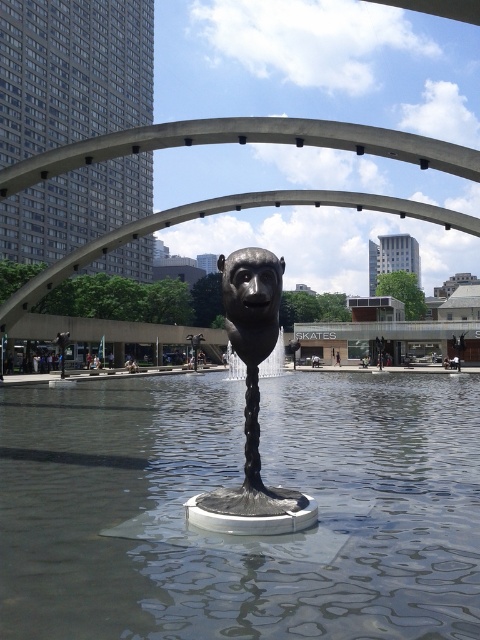
Question: Which object appears closest to the camera in this image?

Choices:
 (A) shiny bronze sculpture at center
 (B) shiny bronze face at center

Answer: (A)

Question: Which of the following is the closest to the observer?

Choices:
 (A) (256, 346)
 (B) (463, 544)

Answer: (B)

Question: Which point is closer to the camera taking this photo?

Choices:
 (A) (231, 307)
 (B) (253, 520)

Answer: (B)

Question: Does shiny metallic water at center have a larger size compared to shiny bronze face at center?

Choices:
 (A) no
 (B) yes

Answer: (B)

Question: Can you confirm if shiny metallic water at center is smaller than shiny bronze face at center?

Choices:
 (A) no
 (B) yes

Answer: (A)

Question: Is shiny bronze sculpture at center to the right of shiny bronze face at center from the viewer's perspective?

Choices:
 (A) no
 (B) yes

Answer: (A)